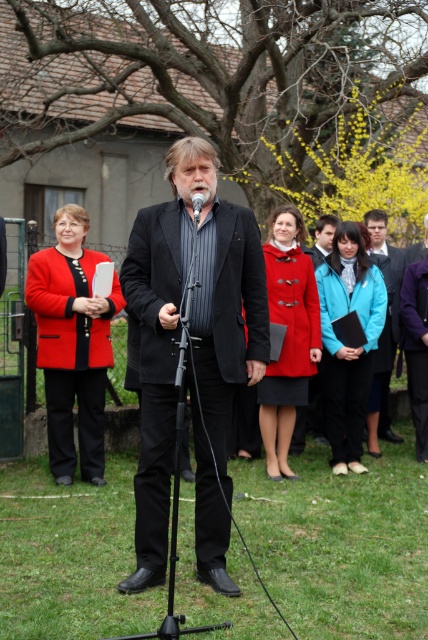
Question: Can you confirm if matte red coat at left is positioned below black matte microphone at center?

Choices:
 (A) yes
 (B) no

Answer: (A)

Question: Considering the real-world distances, which object is closest to the turquoise fabric jacket at center?

Choices:
 (A) graywoollybeard at center
 (B) matte red coat at center
 (C) matte red coat at left
 (D) black metal tripod at center

Answer: (B)

Question: From the image, what is the correct spatial relationship of matte black suit at center in relation to turquoise fabric jacket at center?

Choices:
 (A) right
 (B) left

Answer: (B)

Question: Among these points, which one is farthest from the camera?

Choices:
 (A) tap(210, 385)
 (B) tap(333, 316)

Answer: (B)

Question: Which is nearer to the matte red coat at center?

Choices:
 (A) blue fabric jacket at center
 (B) black metal tripod at center
 (C) graywoollybeard at center

Answer: (A)

Question: Does blue fabric jacket at center appear over graywoollybeard at center?

Choices:
 (A) yes
 (B) no

Answer: (B)